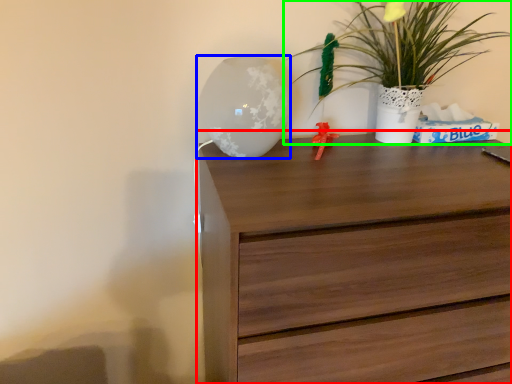
Question: Which object is positioned closest to chest of drawers (highlighted by a red box)? Select from table lamp (highlighted by a blue box) and houseplant (highlighted by a green box).

Choices:
 (A) table lamp
 (B) houseplant

Answer: (A)